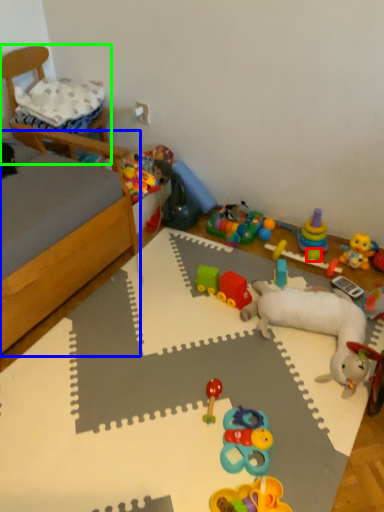
Question: Estimate the real-world distances between objects in this image. Which object is closer to toy (highlighted by a red box), bed frame (highlighted by a blue box) or furniture (highlighted by a green box)?

Choices:
 (A) bed frame
 (B) furniture

Answer: (A)